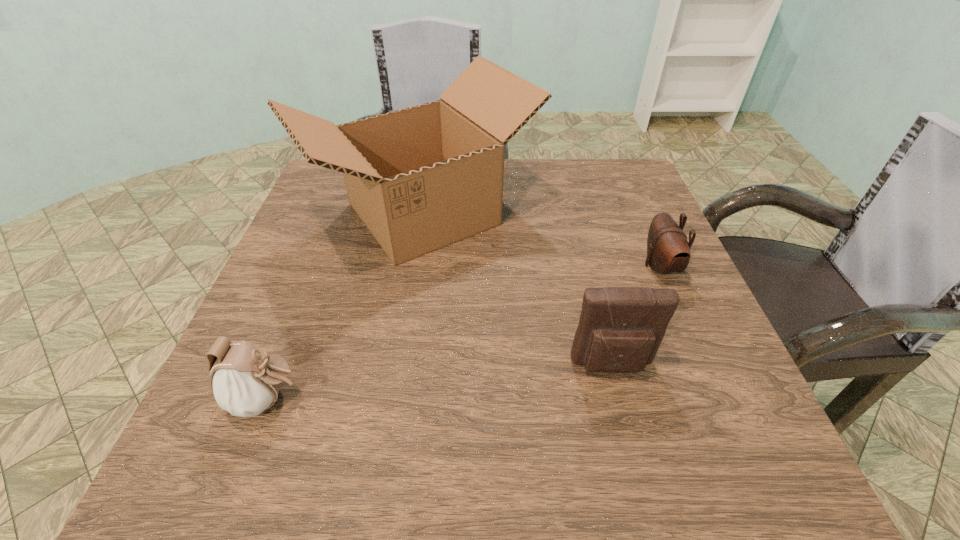
Where is `box`? The height and width of the screenshot is (540, 960). box is located at coordinates (422, 178).

Identify the location of the tallest pouch. (620, 329).

Identify the location of the third shortest object. (620, 329).

At what (x,y) coordinates should I click in order to perform the action: click on the third tallest object. Please return your answer as a coordinate pair (x, y). Image resolution: width=960 pixels, height=540 pixels. Looking at the image, I should click on (245, 381).

You are a GUI agent. You are given a task and a screenshot of the screen. Output one action in this format:
    pyautogui.click(x=<x>, y=<y>)
    Task: Click on the second tallest pouch
    The image size is (960, 540).
    Given the screenshot: What is the action you would take?
    pyautogui.click(x=245, y=381)

Locate an element on the screen. The width and height of the screenshot is (960, 540). the rightmost pouch is located at coordinates (668, 250).

You are a GUI agent. You are given a task and a screenshot of the screen. Output one action in this format:
    pyautogui.click(x=<x>, y=<y>)
    Task: Click on the shortest pouch
    This screenshot has height=540, width=960.
    Given the screenshot: What is the action you would take?
    pyautogui.click(x=668, y=250)

Identify the location of vacant area situated 0.220m on the front of the box. (397, 381).

The height and width of the screenshot is (540, 960). I want to click on free space located with an open flap on the second tallest object, so click(x=622, y=407).

The height and width of the screenshot is (540, 960). Identify the location of free location located 0.250m on the front-facing side of the second shortest object. (465, 399).